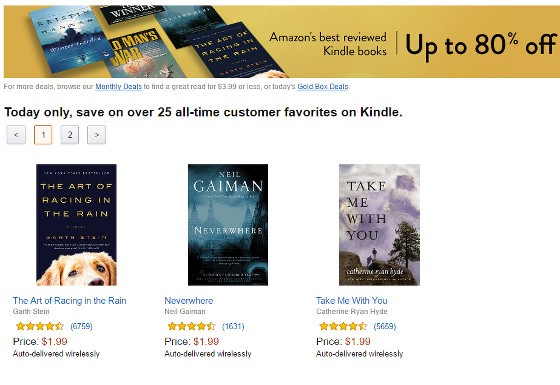
Where is `book covers`? This screenshot has height=385, width=560. book covers is located at coordinates (78, 222), (228, 231), (371, 223), (234, 45), (206, 28), (126, 11), (138, 51), (60, 40).